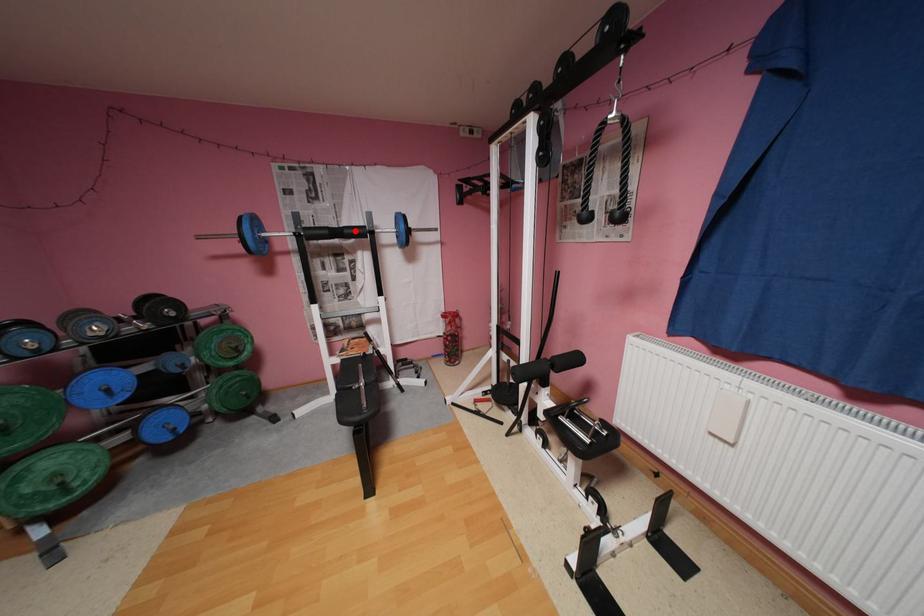
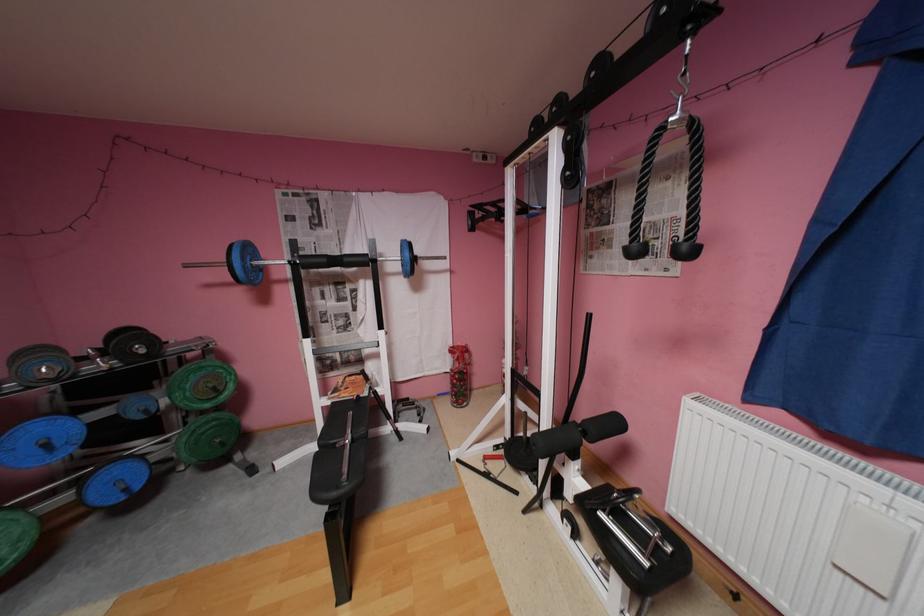
Locate, in the second image, the point that corresponds to the highlighted location in the first image.

(355, 259)